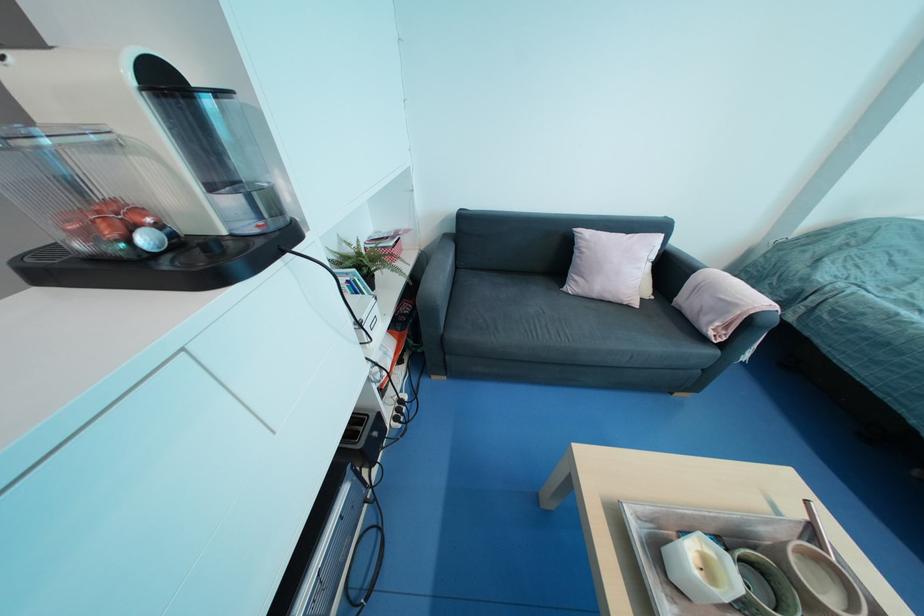
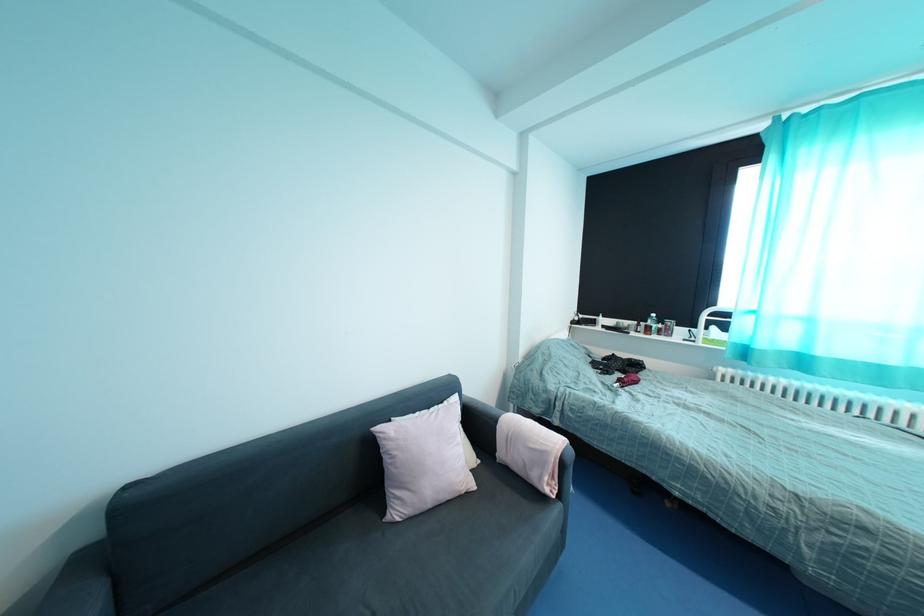
First-person continuous shooting, in which direction is the camera rotating?

The camera rotated toward right-up.